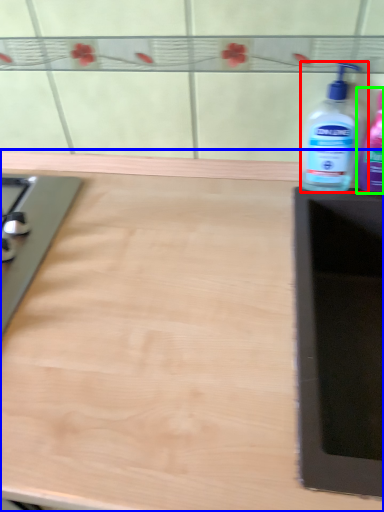
Question: Considering the real-world distances, which object is farthest from bottle (highlighted by a red box)? countertop (highlighted by a blue box) or bottle (highlighted by a green box)?

Choices:
 (A) countertop
 (B) bottle

Answer: (A)